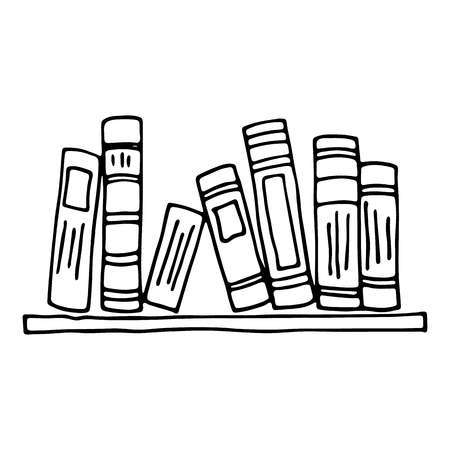
Where is `books`? The height and width of the screenshot is (450, 450). books is located at coordinates (377, 240), (338, 240), (281, 235), (231, 229), (173, 255), (119, 225), (69, 218).